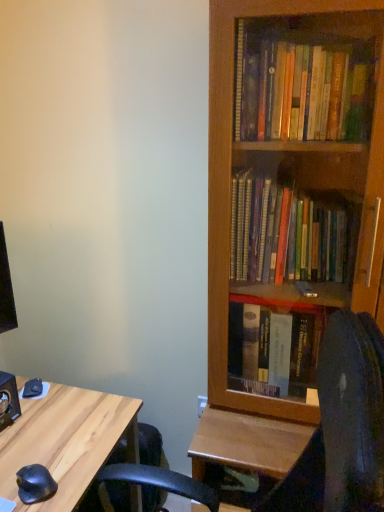
Find the location of a particular element. free spot above light wood desk at lower left (from a real-world perspective) is located at coordinates (45, 432).